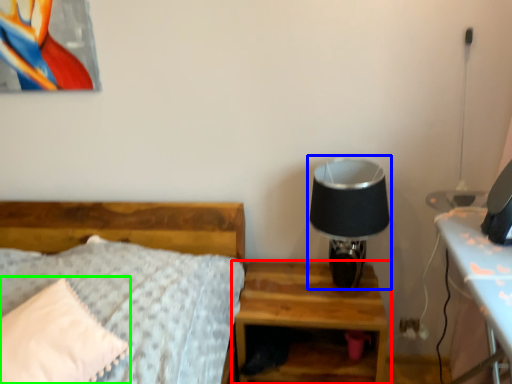
Question: Which object is the farthest from nightstand (highlighted by a red box)? Choose among these: table lamp (highlighted by a blue box) or pillow (highlighted by a green box).

Choices:
 (A) table lamp
 (B) pillow

Answer: (B)